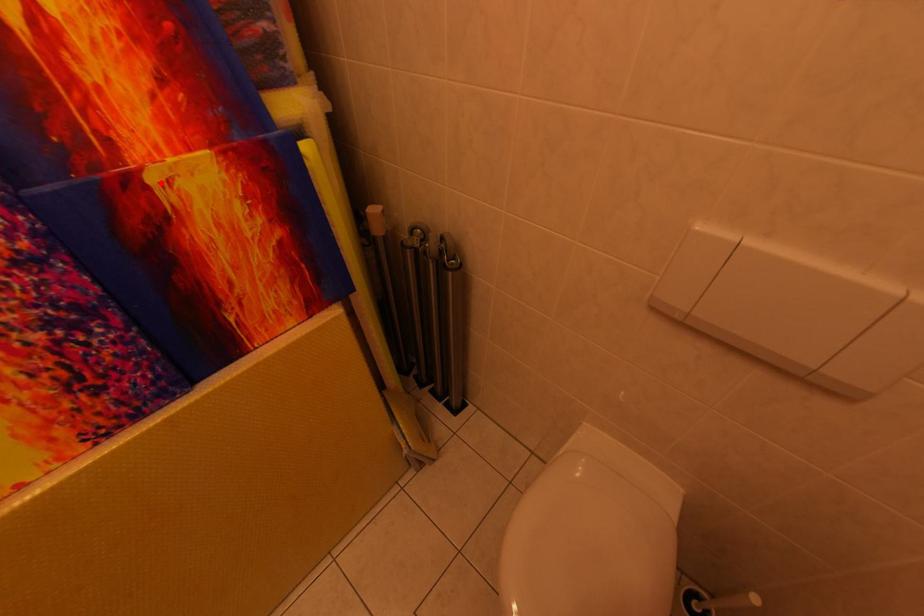
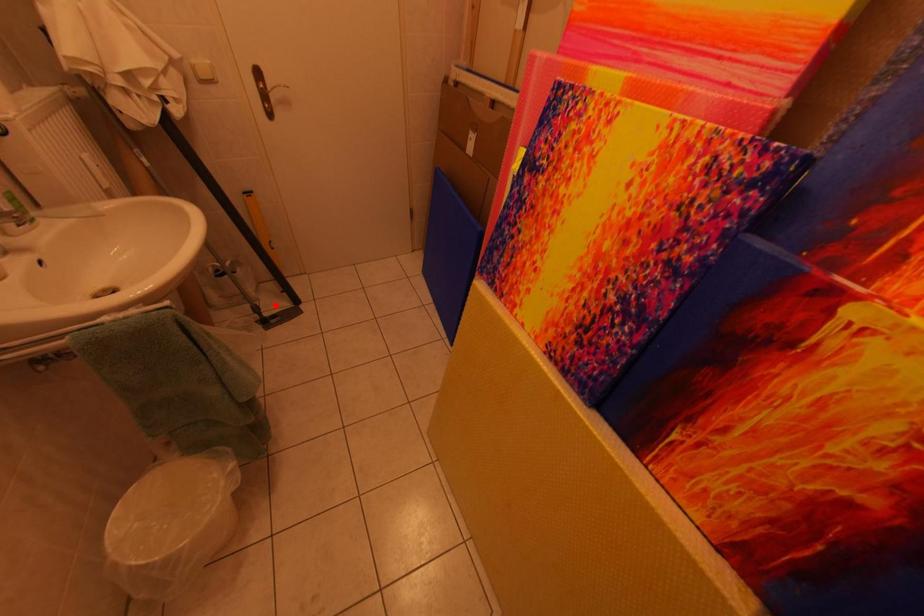
I am providing you with two images of the same scene from different viewpoints. A red point is marked on the first image and another point is marked on the second image. Does the point marked in image1 correspond to the same location as the one in image2?

No